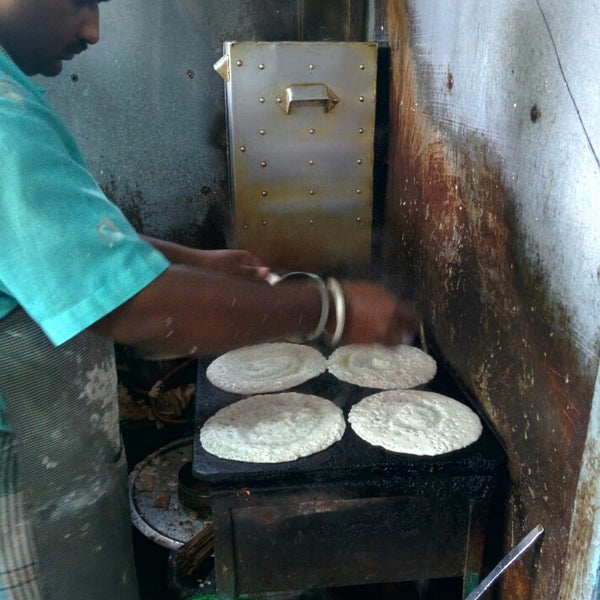
Identify the location of handle. (298, 97), (220, 74).